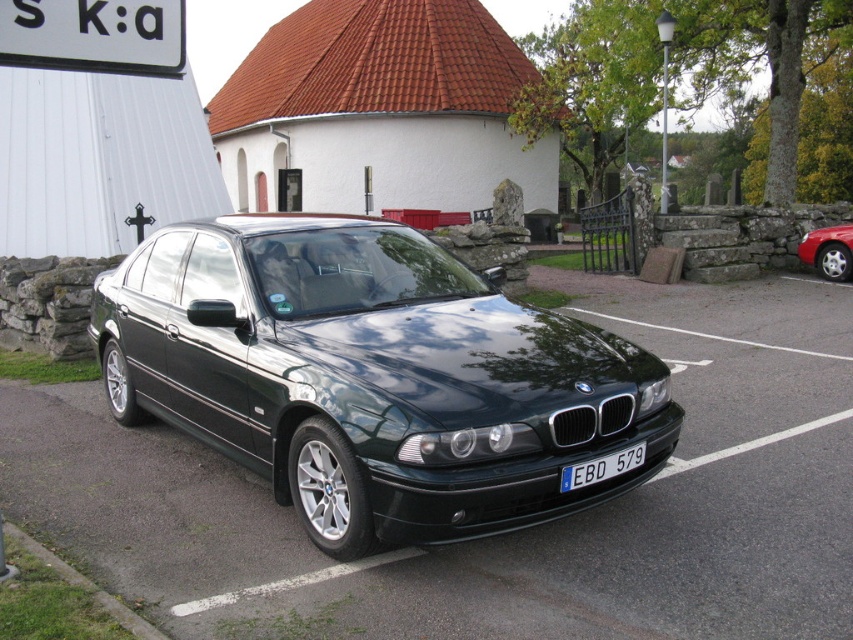
You are a delivery driver who needs to back out of the parking spot between the shiny dark green car at center and the metallic red car at right. Which car should you avoid hitting as you back out?

The shiny dark green car at center is in front of the metallic red car at right, so when backing out, you should avoid hitting the metallic red car at right which is positioned behind the green car.

You are a delivery driver who needs to park your truck next to the shiny dark green car at center and the metallic red car at right. Based on their widths, which car should you park next to to ensure your truck fits without overlapping?

The shiny dark green car at center might be wider than metallic red car at right, so you should park next to the metallic red car at right to ensure your truck fits without overlapping.